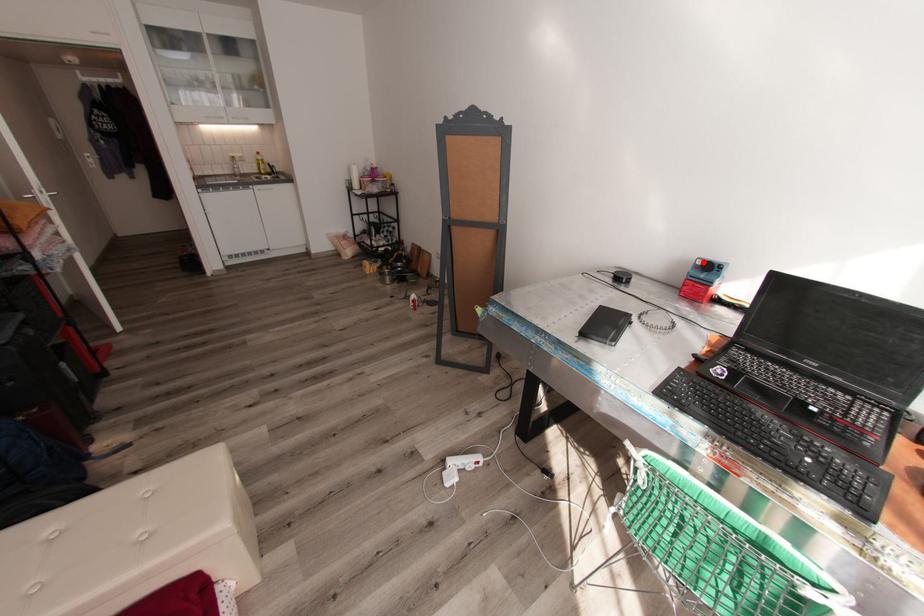
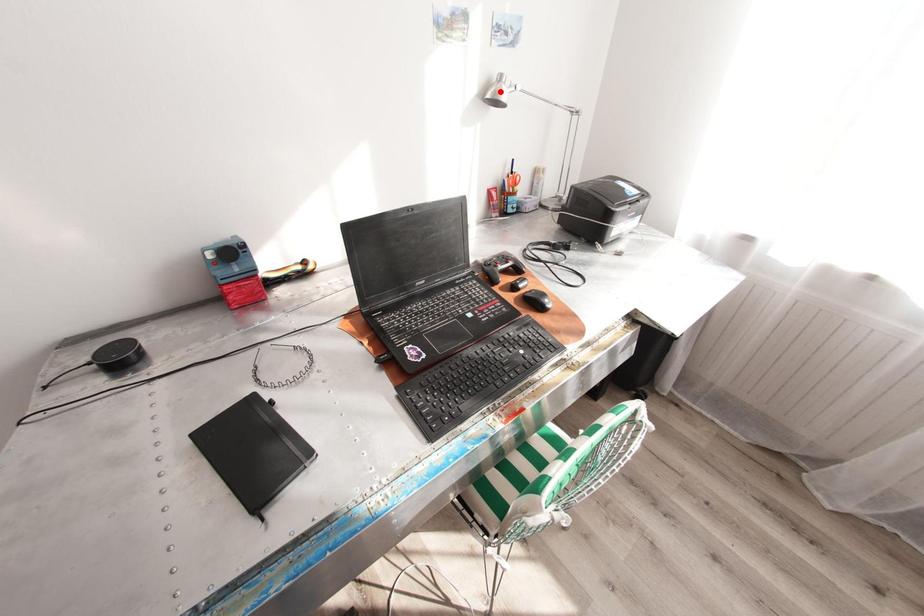
I am providing you with two images of the same scene from different viewpoints. A red point is marked on the first image and another point is marked on the second image. Is the marked point in image1 the same physical position as the marked point in image2?

No